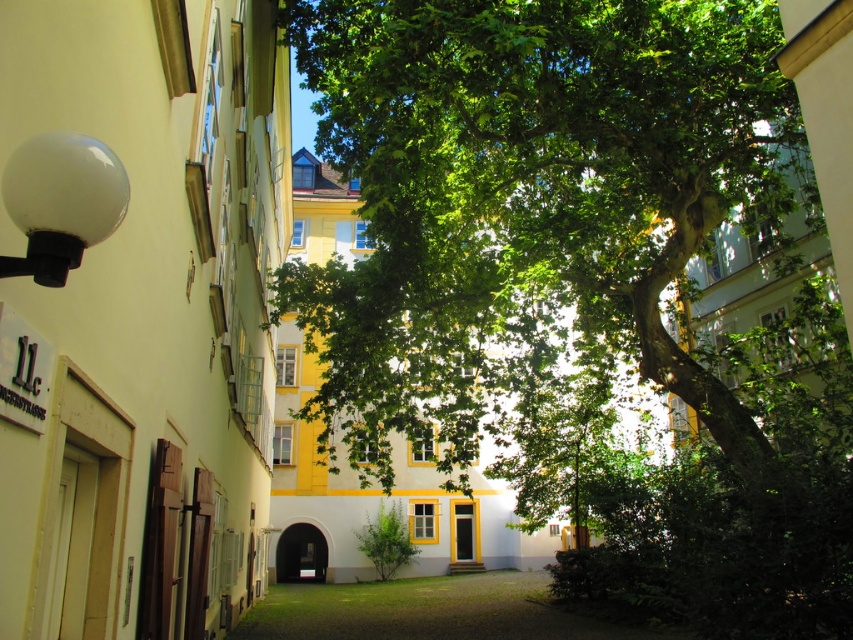
Does green leafy tree at center come behind green grass at center?

No, green leafy tree at center is closer to the viewer.

Between point (392, 337) and point (454, 625), which one is positioned in front?

Point (454, 625)

Identify the location of green leafy tree at center. The height and width of the screenshot is (640, 853). (575, 272).

The image size is (853, 640). What are the coordinates of `green leafy tree at center` in the screenshot? It's located at [x=575, y=272].